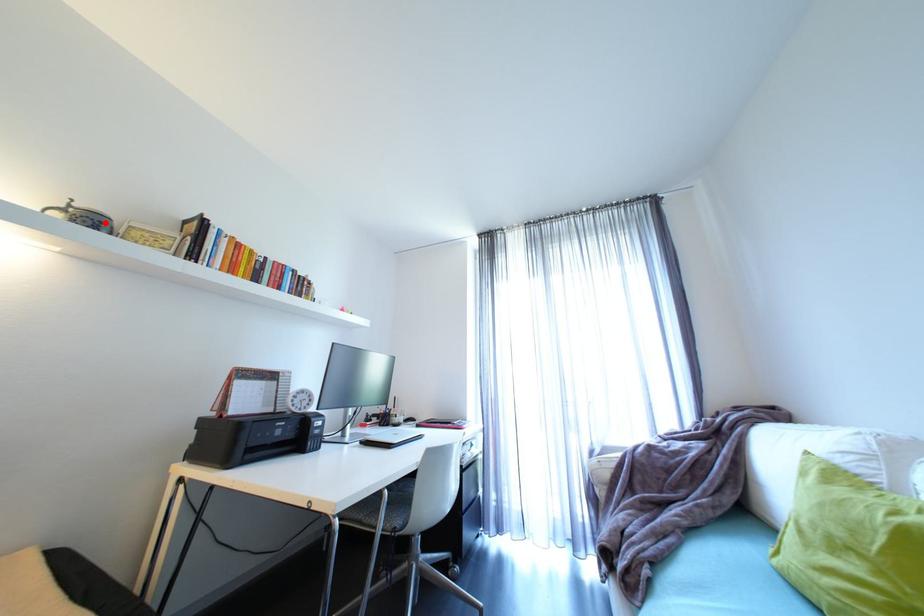
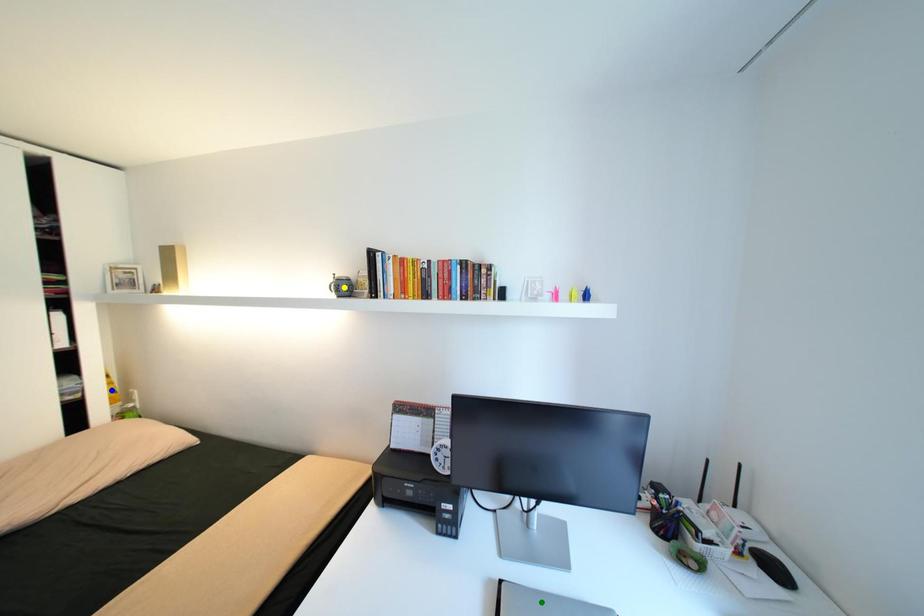
Question: I am providing you with two images of the same scene from different viewpoints. A red point is marked on the first image. You are given multiple points on the second image. Which mark in image 2 goes with the point in image 1?

Choices:
 (A) blue point
 (B) green point
 (C) yellow point

Answer: (C)